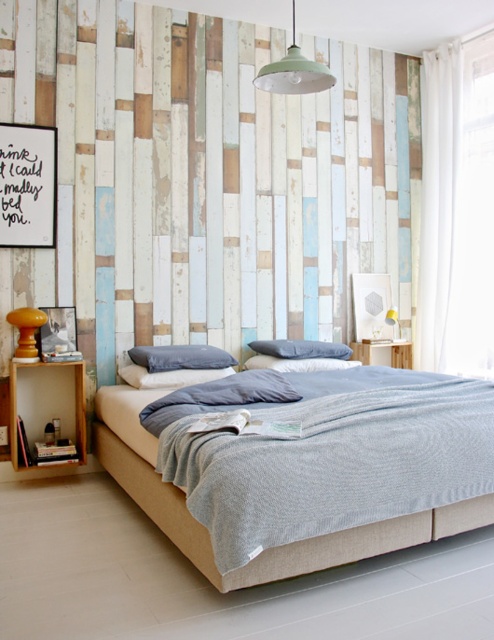
You are a guest in this bedroom and want to turn on the green matte pendant light at upper center. However, you notice the dark gray fabric pillow at center might be blocking your access to the light switch. Is the light switch likely behind the pillow or in front of it?

The green matte pendant light at upper center is in front of the dark gray fabric pillow at center, so the light switch is likely in front of the pillow.

You are standing at the entrance of the bedroom and want to place a new decorative item on the highest point between the light beige fabric bed at center and the blue cotton pillow at center. Which object should you choose to place it on?

You should place the decorative item on the blue cotton pillow at center because it is higher than the light beige fabric bed at center.